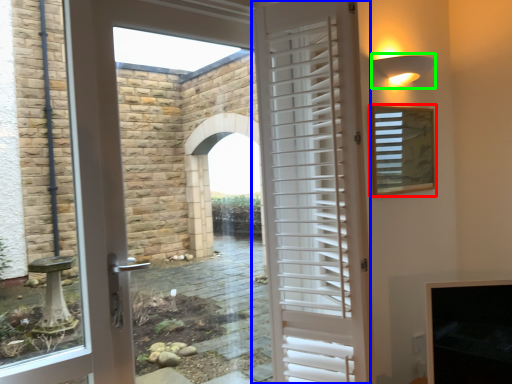
Question: Which object is the farthest from window screen (highlighted by a red box)? Choose among these: door (highlighted by a blue box) or light fixture (highlighted by a green box).

Choices:
 (A) door
 (B) light fixture

Answer: (A)